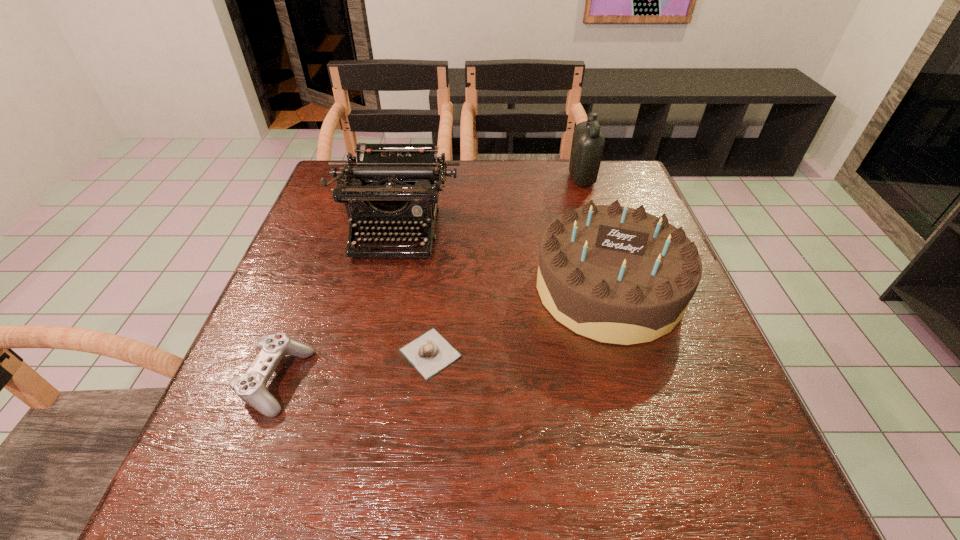
Where is `the farthest object`? The image size is (960, 540). the farthest object is located at coordinates (588, 142).

The image size is (960, 540). In order to click on typewriter in this screenshot , I will do `click(390, 184)`.

The image size is (960, 540). Find the location of `the third shortest object`. the third shortest object is located at coordinates pyautogui.click(x=614, y=274).

Where is `control`? This screenshot has width=960, height=540. control is located at coordinates (251, 387).

Where is `the shortest object`? This screenshot has width=960, height=540. the shortest object is located at coordinates (429, 353).

You are a GUI agent. You are given a task and a screenshot of the screen. Output one action in this format:
    pyautogui.click(x=<x>, y=<y>)
    Task: Click on the vacant region located 0.180m on the left of the bottle
    
    Given the screenshot: What is the action you would take?
    pyautogui.click(x=507, y=179)

You are a GUI agent. You are given a task and a screenshot of the screen. Output one action in this format:
    pyautogui.click(x=<x>, y=<y>)
    Task: Click on the free region located on the keyboard of the typewriter
    This screenshot has height=540, width=960.
    Given the screenshot: What is the action you would take?
    (x=385, y=280)

Locate an element on the screen. Image resolution: width=960 pixels, height=540 pixels. vacant space located 0.140m on the front-facing side of the third shortest object is located at coordinates (645, 414).

The height and width of the screenshot is (540, 960). In order to click on vacant space located on the right of the control in this screenshot , I will do `click(434, 382)`.

Where is `vacant position located on the left of the shortest object`? vacant position located on the left of the shortest object is located at coordinates (288, 353).